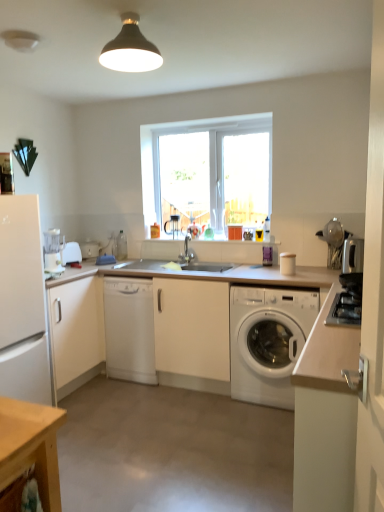
You are a GUI agent. You are given a task and a screenshot of the screen. Output one action in this format:
    pyautogui.click(x=<x>, y=<y>)
    Task: Click on the free region under matte black lampshade at upper center (from a real-world perspective)
    
    Given the screenshot: What is the action you would take?
    pyautogui.click(x=155, y=465)